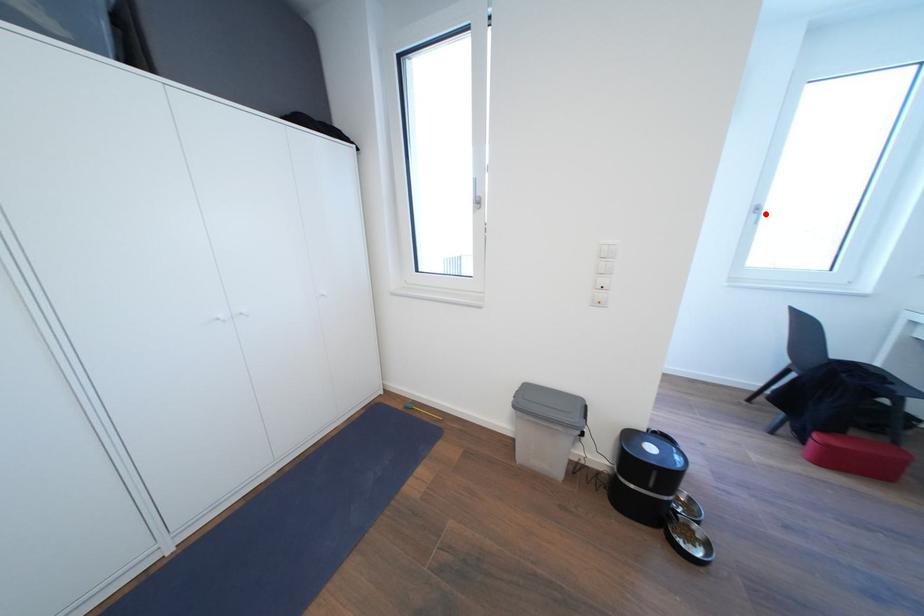
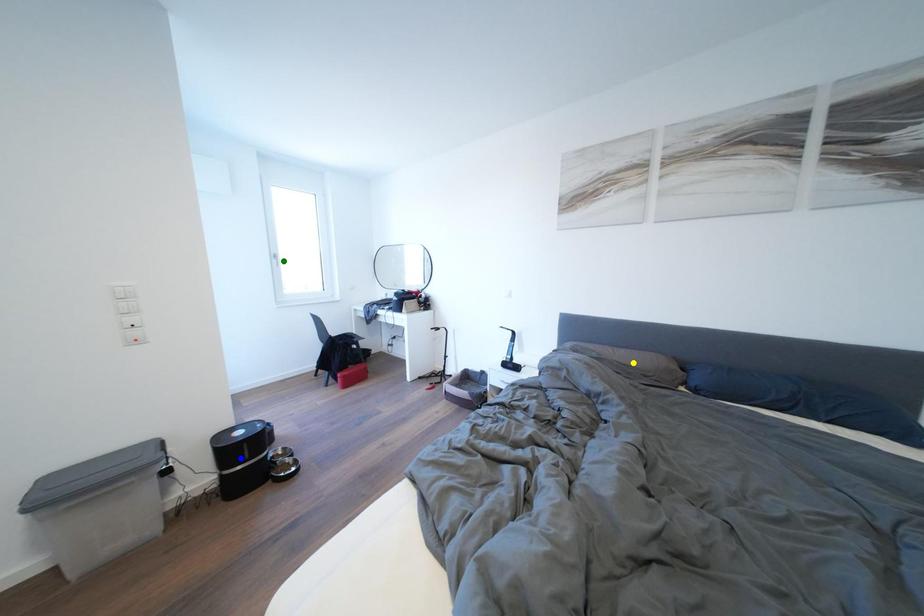
Question: I am providing you with two images of the same scene from different viewpoints. A red point is marked on the first image. You are given multiple points on the second image. Which mark in image 2 goes with the point in image 1?

Choices:
 (A) blue point
 (B) green point
 (C) yellow point

Answer: (B)